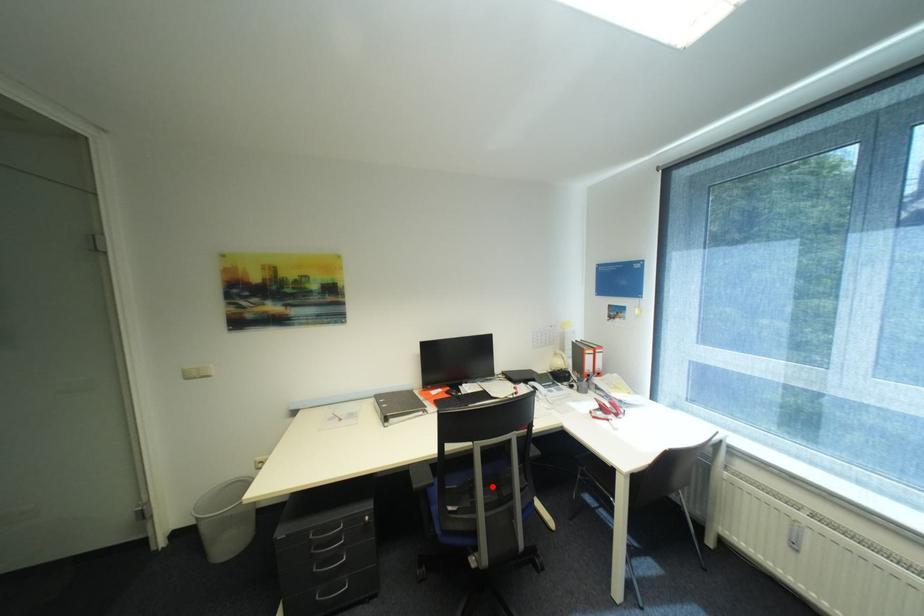
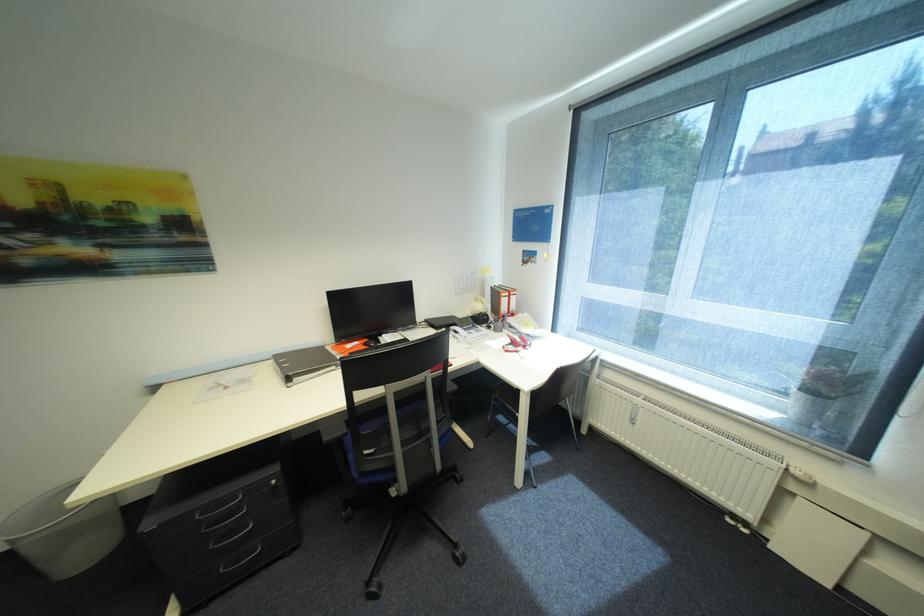
Question: I am providing you with two images of the same scene from different viewpoints. In image1, a red point is highlighted. Considering the same 3D point in image2, which of the following is correct?

Choices:
 (A) It is closer
 (B) It is farther

Answer: (A)